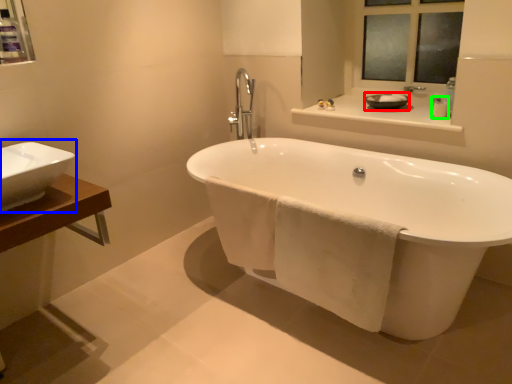
Question: Based on their relative distances, which object is nearer to basin (highlighted by a red box)? Choose from sink (highlighted by a blue box) and toiletry (highlighted by a green box).

Choices:
 (A) sink
 (B) toiletry

Answer: (B)